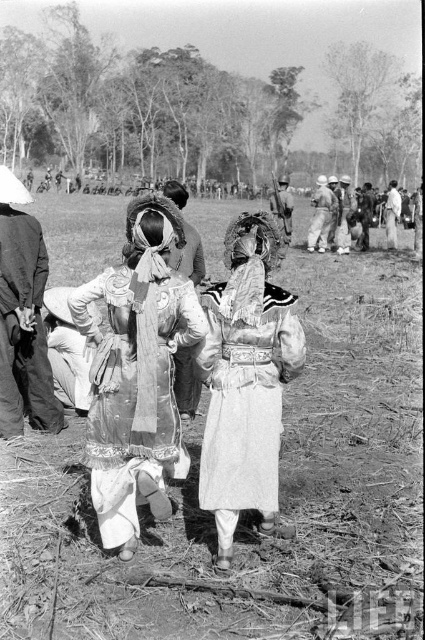
Is point (359, 291) positioned after point (212, 435)?

Yes, point (359, 291) is farther from viewer.

Which of these two, dirt field at center or white textured dress at center, stands shorter?

Standing shorter between the two is white textured dress at center.

Who is more forward, (153, 637) or (254, 328)?

Positioned in front is point (153, 637).

Find the location of a particular element. The image size is (425, 640). dirt field at center is located at coordinates (350, 440).

Looking at this image, between dirt field at center and embroidered silk dress at center, which one has more height?

With more height is dirt field at center.

Is point (240, 556) farther from camera compared to point (142, 380)?

Yes, it is.

Measure the distance between point (187, 632) and camera.

The distance of point (187, 632) from camera is 10.51 feet.

At what (x,y) coordinates should I click in order to perform the action: click on dirt field at center. Please return your answer as a coordinate pair (x, y). Looking at the image, I should click on (350, 440).

Between embroidered silk dress at center and white textured dress at center, which one is positioned higher?

embroidered silk dress at center is higher up.

Can you confirm if embroidered silk dress at center is smaller than white textured dress at center?

Actually, embroidered silk dress at center might be larger than white textured dress at center.

Find the location of a particular element. embroidered silk dress at center is located at coordinates (136, 371).

Where is `embroidered silk dress at center`? embroidered silk dress at center is located at coordinates (136, 371).